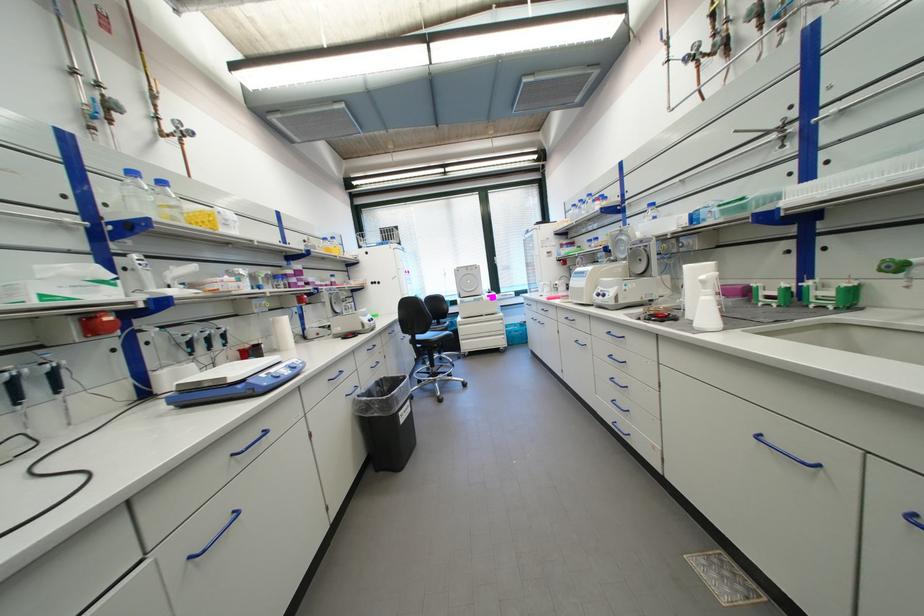
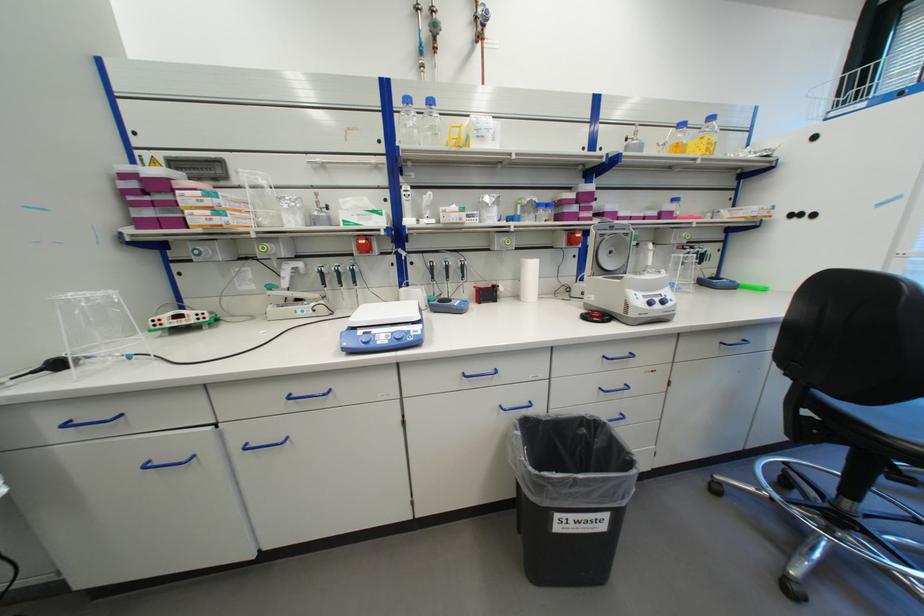
The point at (x=156, y=180) is marked in the first image. Where is the corresponding point in the second image?

(428, 103)